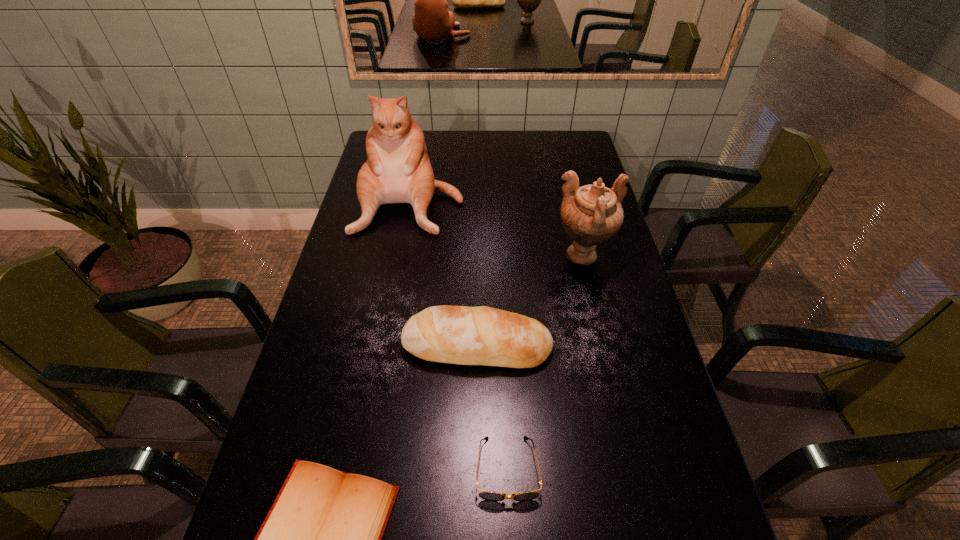
Where is `cat`? cat is located at coordinates (398, 170).

This screenshot has width=960, height=540. I want to click on the tallest object, so click(398, 170).

At what (x,y) coordinates should I click in order to perform the action: click on urn. Please return your answer as a coordinate pair (x, y). Looking at the image, I should click on point(592,214).

Locate an element on the screen. the rightmost object is located at coordinates (592, 214).

Identify the location of bread. The width and height of the screenshot is (960, 540). (462, 335).

At what (x,y) coordinates should I click in order to perform the action: click on the third nearest object. Please return your answer as a coordinate pair (x, y). This screenshot has height=540, width=960. Looking at the image, I should click on (462, 335).

In order to click on the fourth tallest object in this screenshot , I will do `click(486, 495)`.

The width and height of the screenshot is (960, 540). What are the coordinates of `vacant area situated on the face of the farthest object` in the screenshot? It's located at (394, 291).

Where is `vacant area situated 0.050m on the left of the rightmost object`? vacant area situated 0.050m on the left of the rightmost object is located at coordinates (538, 256).

This screenshot has width=960, height=540. What are the coordinates of `free space located 0.070m on the front of the third shortest object` in the screenshot? It's located at (477, 399).